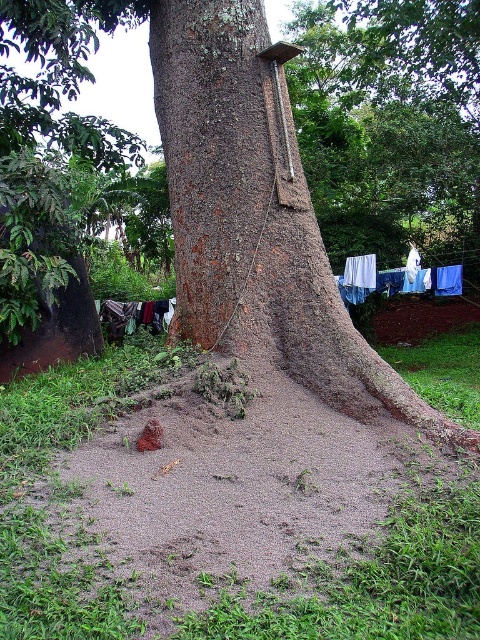
Can you confirm if brown rough tree trunk at center is bigger than white fabric at lower right?

Indeed, brown rough tree trunk at center has a larger size compared to white fabric at lower right.

Between brown rough tree trunk at center and white fabric at lower right, which one has more height?

brown rough tree trunk at center

What do you see at coordinates (256, 216) in the screenshot? I see `brown rough tree trunk at center` at bounding box center [256, 216].

Where is `brown rough tree trunk at center`? This screenshot has height=640, width=480. brown rough tree trunk at center is located at coordinates (256, 216).

Which is more to the right, blue fabric clothes at lower right or dark blue fabric at lower left?

Positioned to the right is blue fabric clothes at lower right.

Is point (362, 284) positioned after point (121, 316)?

No, it is in front of (121, 316).

Is point (357, 259) closer to camera compared to point (103, 301)?

That is True.

Identify the location of blue fabric clothes at lower right. (396, 278).

Image resolution: width=480 pixels, height=640 pixels. Describe the element at coordinates (256, 216) in the screenshot. I see `brown rough tree trunk at center` at that location.

Does brown rough tree trunk at center appear under dark blue fabric at lower left?

No.

Does point (247, 70) lie behind point (147, 324)?

That is False.

Where is `brown rough tree trunk at center`? Image resolution: width=480 pixels, height=640 pixels. brown rough tree trunk at center is located at coordinates (256, 216).